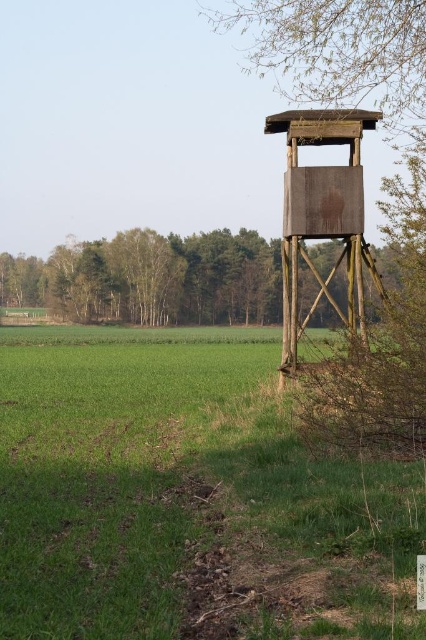
Between green grass at lower left and brown wooden tower at upper right, which one has less height?

With less height is green grass at lower left.

Which is below, green grass at lower left or brown wooden tower at upper right?

Positioned lower is green grass at lower left.

Between point (227, 508) and point (259, 301), which one is positioned behind?

The point (259, 301) is behind.

I want to click on green grass at lower left, so click(187, 497).

Between green grass at lower left and rustic wooden tower at center, which one appears on the right side from the viewer's perspective?

rustic wooden tower at center is more to the right.

Between point (264, 392) and point (291, 266), which one is positioned in front?

Point (291, 266)

In order to click on green grass at lower left in this screenshot , I will do `click(187, 497)`.

Measure the distance between point (28, 282) and camera.

Point (28, 282) and camera are 103.05 meters apart.

Is brown wooden tower at upper right behind rustic wooden tower at center?

Yes, brown wooden tower at upper right is behind rustic wooden tower at center.

Between point (255, 268) and point (288, 349), which one is positioned behind?

Positioned behind is point (255, 268).

You are a GUI agent. You are given a task and a screenshot of the screen. Output one action in this format:
    pyautogui.click(x=<x>, y=<y>)
    Task: Click on the brown wooden tower at upper right
    This screenshot has width=426, height=640.
    Given the screenshot: What is the action you would take?
    pyautogui.click(x=152, y=278)